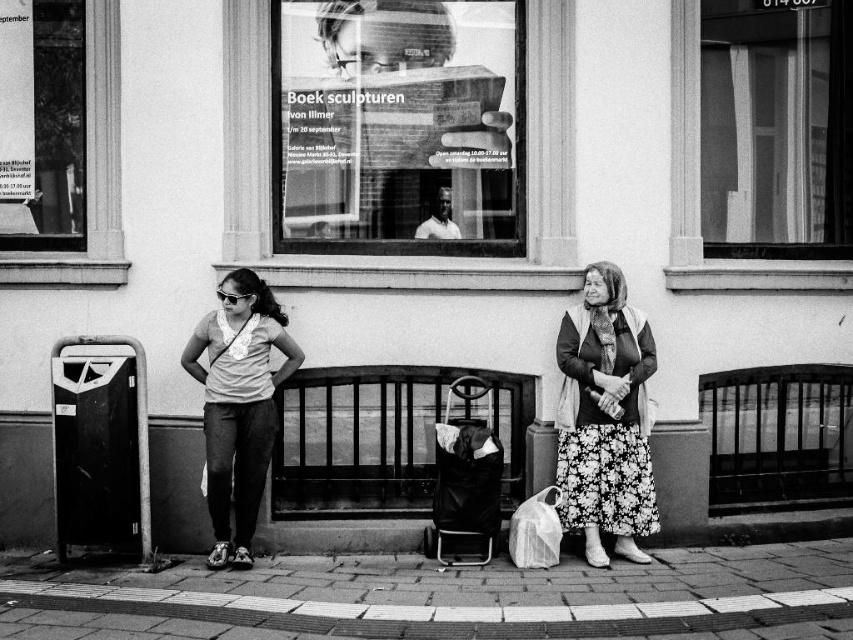
You are standing at the entrance of the building and want to place a small potted plant on the brick pavement at lower center. According to the image, where exactly should you place it?

The brick pavement at lower center is located at point (442, 596), so place the plant there.

You are a delivery person trying to place a package on the ground. The package is the size of the translucent plastic bag at lower center. Is there enough space on the brick pavement at lower center to place the package without it overlapping the bag?

The brick pavement at lower center might be wider than the translucent plastic bag at lower center, so there is likely enough space to place the package without overlapping the bag.

You are a photographer trying to capture the scene in front of you. You notice the floral skirt at center and the translucent plastic bag at lower center. Which object is positioned more to the right side of the scene?

The floral skirt at center is positioned to the right of the translucent plastic bag at lower center, so the floral skirt at center is more to the right side of the scene.